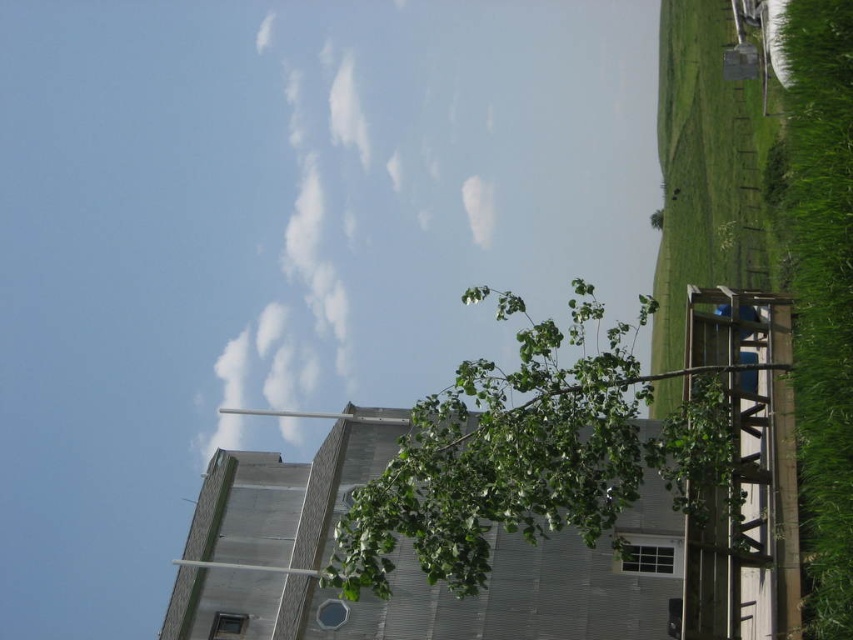
Does white fluffy cloud at upper center have a lesser width compared to green leafy tree at upper right?

No.

Who is more forward, (521, 38) or (657, 225)?

Positioned in front is point (657, 225).

Between point (317, 216) and point (654, 227), which one is positioned behind?

The point (317, 216) is behind.

At what (x,y) coordinates should I click in order to perform the action: click on white fluffy cloud at upper center. Please return your answer as a coordinate pair (x, y). The height and width of the screenshot is (640, 853). Looking at the image, I should click on (445, 186).

Can you confirm if green leafy tree at center is positioned to the right of green leafy tree at upper right?

Incorrect, green leafy tree at center is not on the right side of green leafy tree at upper right.

Is point (727, 438) less distant than point (651, 220)?

Yes, it is.

The width and height of the screenshot is (853, 640). I want to click on green leafy tree at center, so click(x=529, y=456).

Does green leafy tree at center have a greater height compared to green grass at right?

In fact, green leafy tree at center may be shorter than green grass at right.

Is point (640, 474) positioned in front of point (834, 109)?

Yes.

Find the location of a particular element. The width and height of the screenshot is (853, 640). green leafy tree at center is located at coordinates (529, 456).